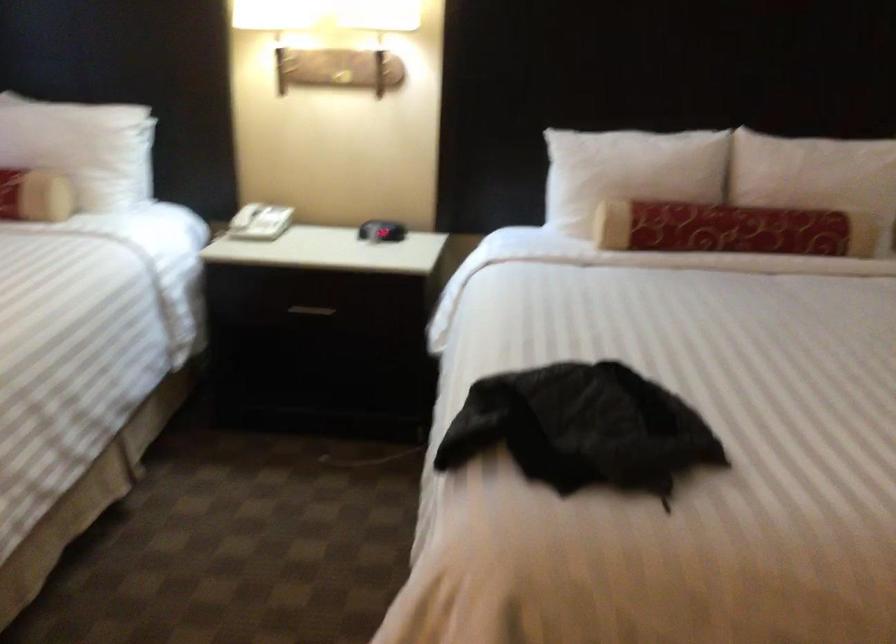
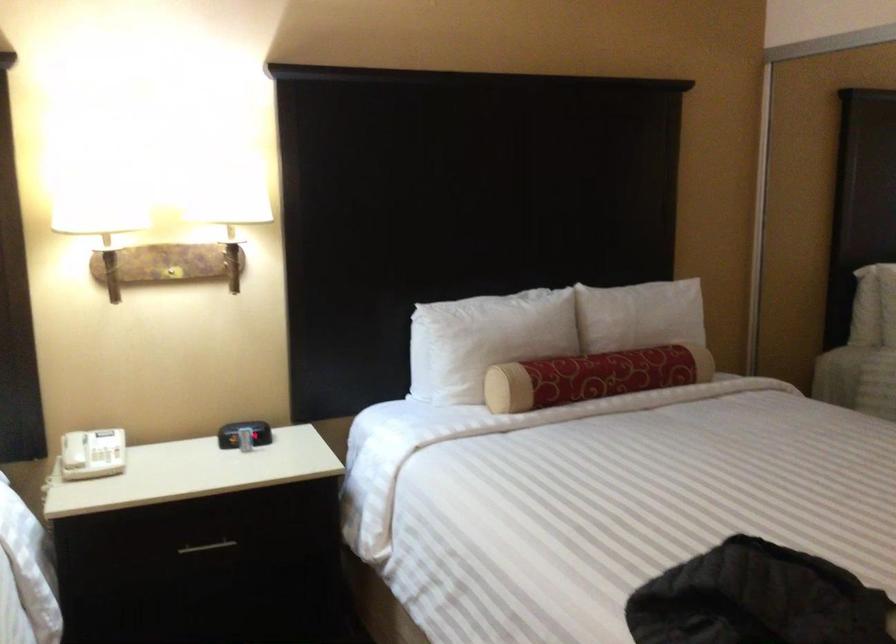
The point at (x=708, y=223) is marked in the first image. Where is the corresponding point in the second image?

(592, 377)